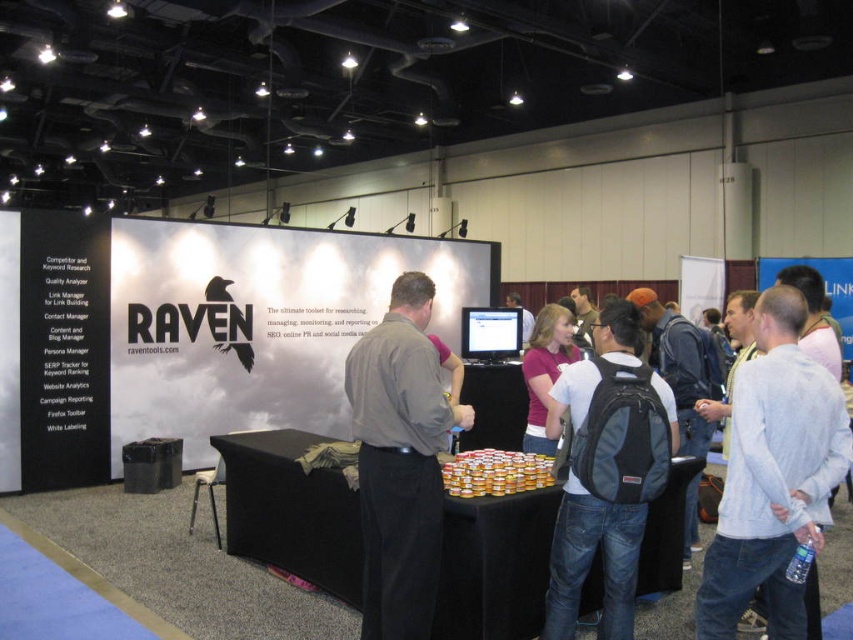
Question: Among these objects, which one is nearest to the camera?

Choices:
 (A) matte pink shirt at center
 (B) dark gray shirt at center
 (C) denim jeans at center

Answer: (B)

Question: Among these points, which one is farthest from the camera?

Choices:
 (A) (407, 310)
 (B) (469, 541)
 (C) (364, 483)
 (D) (556, 413)

Answer: (D)

Question: Can you confirm if gray cotton shirt at right is wider than denim backpack at center?

Choices:
 (A) yes
 (B) no

Answer: (A)

Question: Which of the following is the farthest from the observer?

Choices:
 (A) (769, 620)
 (B) (393, 541)
 (C) (585, 371)
 (D) (602, 564)

Answer: (D)

Question: Is gray cotton shirt at right above denim backpack at center?

Choices:
 (A) no
 (B) yes

Answer: (B)

Question: Is the position of gray cotton shirt at right more distant than that of dark gray shirt at center?

Choices:
 (A) yes
 (B) no

Answer: (B)